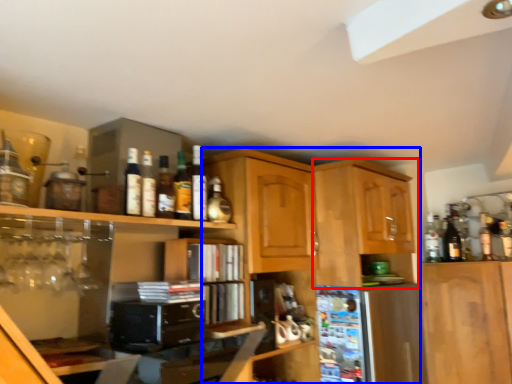
Question: Among these objects, which one is farthest to the camera, cabinetry (highlighted by a red box) or cabinetry (highlighted by a blue box)?

Choices:
 (A) cabinetry
 (B) cabinetry

Answer: (A)